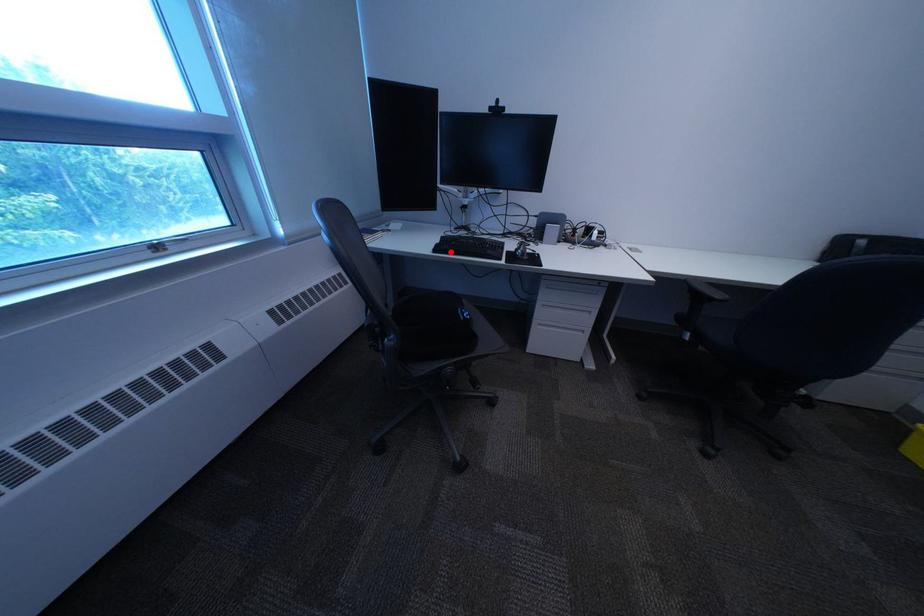
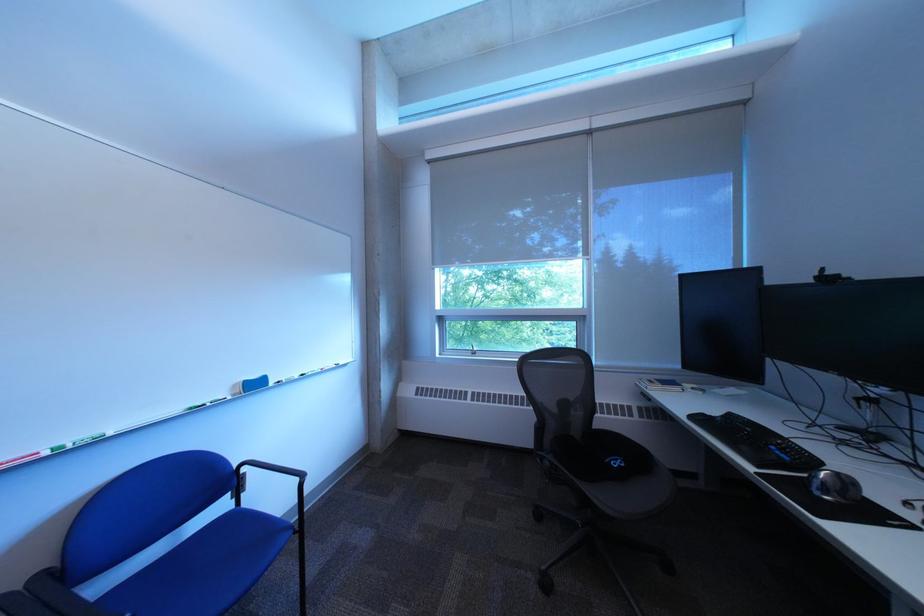
Where in the second image is the point corresponding to the highlighted location from the first image?

(708, 419)